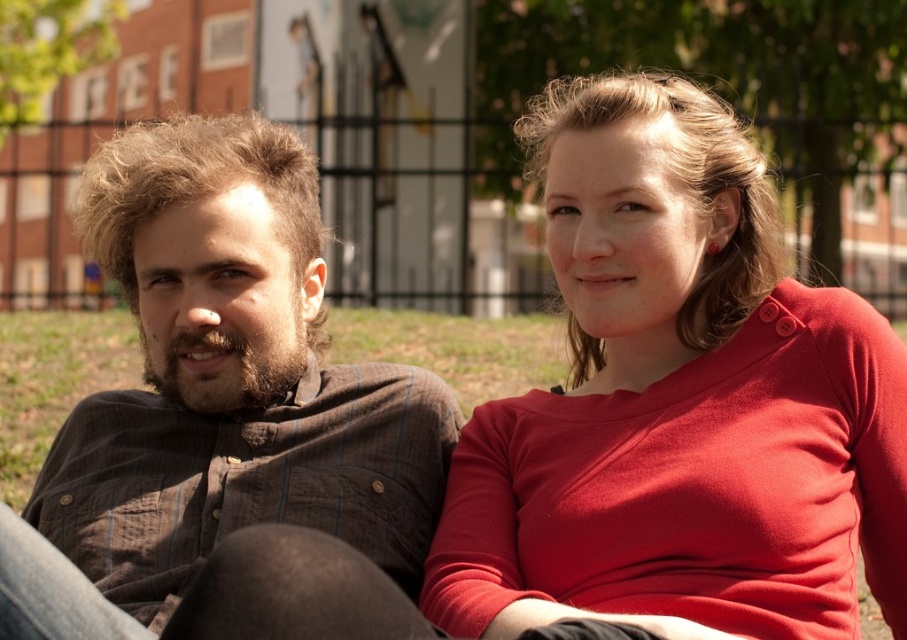
You are a photographer trying to capture the matte red sweater at center in your frame. Based on the scene description, where should you position your camera to ensure the sweater is centered in the photo?

The matte red sweater at center is already positioned at the center of the image, so you should position your camera to aim directly at the center point where the sweater is located at coordinates [678,401].

You are a delivery robot with a width of 1 meter. You need to move between the matte red sweater at center and the brown striped shirt at left. Can you fit through the space between them?

The distance between the matte red sweater at center and the brown striped shirt at left is 1.21 meters, so the robot can fit through the space since it is wider than the robot.